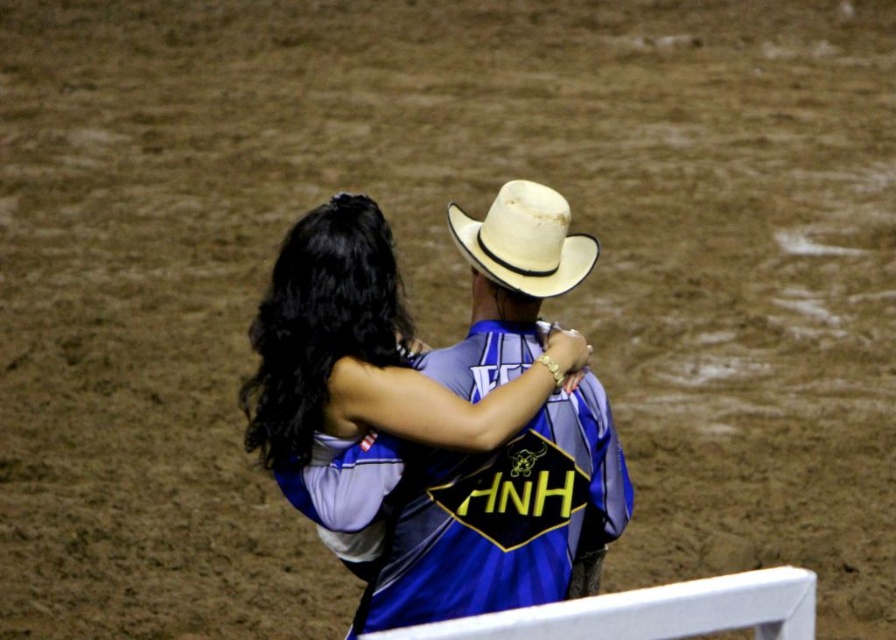
You are a photographer positioned behind the white barrier in the rodeo arena. You need to capture a clear photo of both the matte blue jersey at center and the white straw cowboy hat at upper center. Based on their sizes in the image, which object should you focus on first to ensure both are in frame?

The matte blue jersey at center is much taller than the white straw cowboy hat at upper center, so you should focus on the matte blue jersey at center first to ensure both are in frame.

You are standing at the center of the rodeo arena and see two points marked in the image. Which point is closer to you, point (381, 396) or point (464, 232)?

Point (381, 396) is in front of point (464, 232), so it is closer to you.